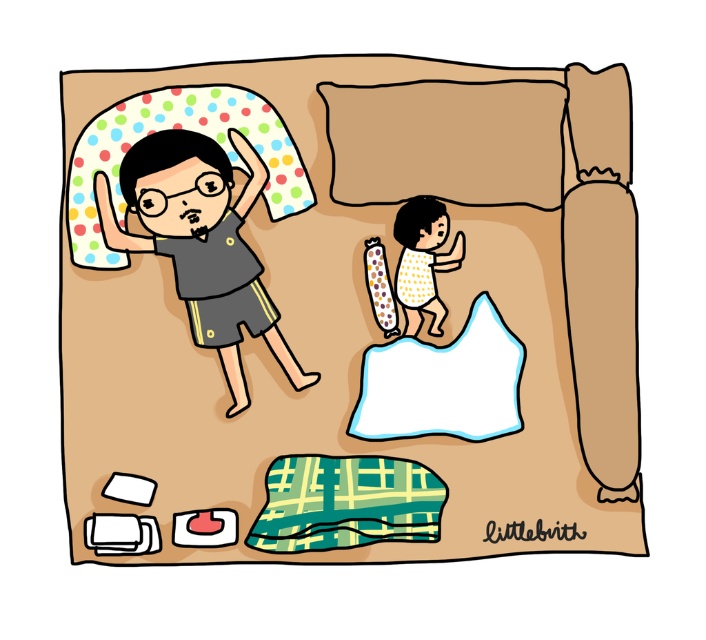
You are trying to place a new decorative item on the bed where the brown fabric pillow at upper center and the yellow dotted shirt at upper center are located. Which object should you move to make space, considering their sizes?

The brown fabric pillow at upper center might be wider than the yellow dotted shirt at upper center, so moving the brown fabric pillow at upper center would likely provide more space.

You are standing in front of the bed and want to place a small gift on the point that is closer to you. Which point should you choose between point (x=366, y=106) and point (x=436, y=310)?

You should choose point (x=366, y=106) because it is closer to you than point (x=436, y=310).

You are a tailor who needs to determine which item is bigger between the brown fabric pillow at upper center and the yellow dotted shirt at upper center. Which one requires more fabric to make?

The brown fabric pillow at upper center is larger in size than the yellow dotted shirt at upper center, so it would require more fabric to make.